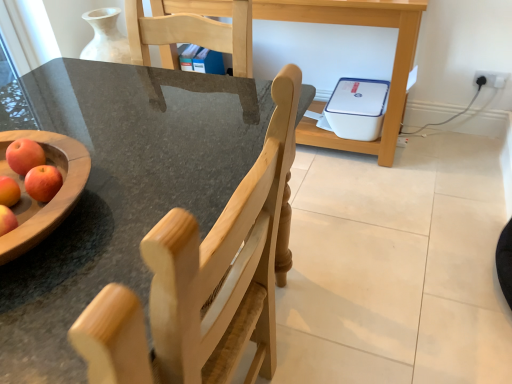
What are the coordinates of `free space in front of white plastic printer at center` in the screenshot? It's located at (371, 227).